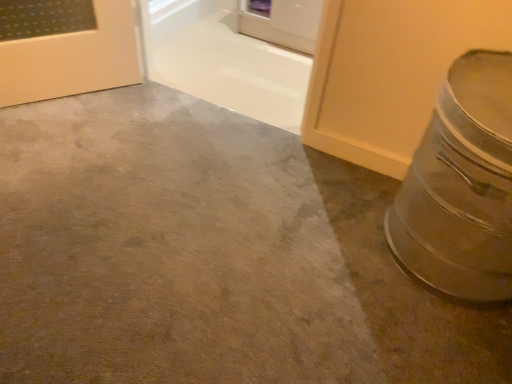
Question: Is white glossy door at upper center with silver metallic crock pot at right?

Choices:
 (A) yes
 (B) no

Answer: (B)

Question: Is white glossy door at upper center positioned far away from silver metallic crock pot at right?

Choices:
 (A) yes
 (B) no

Answer: (A)

Question: Is white glossy door at upper center oriented towards silver metallic crock pot at right?

Choices:
 (A) yes
 (B) no

Answer: (B)

Question: Is white glossy door at upper center positioned behind silver metallic crock pot at right?

Choices:
 (A) no
 (B) yes

Answer: (B)

Question: From a real-world perspective, is white glossy door at upper center positioned under silver metallic crock pot at right based on gravity?

Choices:
 (A) yes
 (B) no

Answer: (A)

Question: Is silver metallic crock pot at right taller or shorter than white glossy door at upper center?

Choices:
 (A) tall
 (B) short

Answer: (A)

Question: Would you say silver metallic crock pot at right is to the left or to the right of white glossy door at upper center in the picture?

Choices:
 (A) right
 (B) left

Answer: (A)

Question: Is silver metallic crock pot at right spatially inside white glossy door at upper center, or outside of it?

Choices:
 (A) inside
 (B) outside

Answer: (B)

Question: Considering the positions of silver metallic crock pot at right and white glossy door at upper center in the image, is silver metallic crock pot at right wider or thinner than white glossy door at upper center?

Choices:
 (A) wide
 (B) thin

Answer: (A)

Question: Considering the positions of smooth concrete at lower right and silver metallic crock pot at right in the image, is smooth concrete at lower right wider or thinner than silver metallic crock pot at right?

Choices:
 (A) thin
 (B) wide

Answer: (B)

Question: Is smooth concrete at lower right bigger or smaller than silver metallic crock pot at right?

Choices:
 (A) big
 (B) small

Answer: (B)

Question: Considering the relative positions of smooth concrete at lower right and silver metallic crock pot at right in the image provided, is smooth concrete at lower right to the left or to the right of silver metallic crock pot at right?

Choices:
 (A) right
 (B) left

Answer: (B)

Question: In terms of height, does smooth concrete at lower right look taller or shorter compared to silver metallic crock pot at right?

Choices:
 (A) tall
 (B) short

Answer: (B)

Question: From a real-world perspective, relative to smooth concrete at lower right, is white glossy door at upper center vertically above or below?

Choices:
 (A) above
 (B) below

Answer: (A)

Question: Is white glossy door at upper center inside or outside of smooth concrete at lower right?

Choices:
 (A) inside
 (B) outside

Answer: (B)